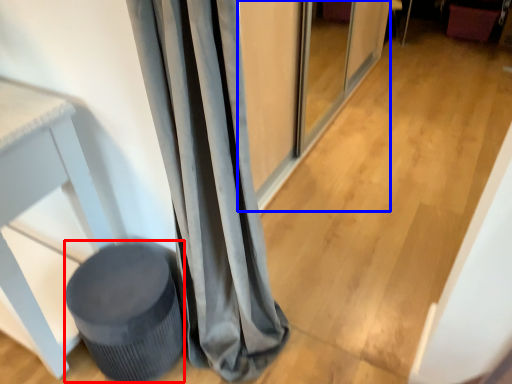
Question: Which of the following is the closest to the observer, music stool (highlighted by a red box) or screen door (highlighted by a blue box)?

Choices:
 (A) music stool
 (B) screen door

Answer: (A)